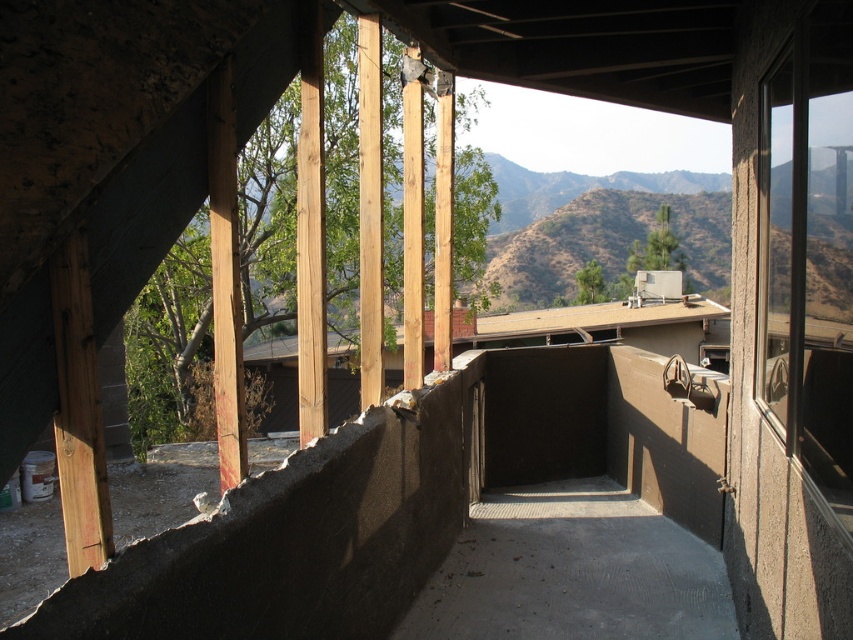
Between point (364, 138) and point (402, 314), which one is positioned in front?

Positioned in front is point (364, 138).

Which is behind, point (361, 266) or point (405, 131)?

Positioned behind is point (405, 131).

Who is more distant from viewer, (376,100) or (416,257)?

The point (416,257) is more distant.

Where is `natural wood beam at center`? Image resolution: width=853 pixels, height=640 pixels. natural wood beam at center is located at coordinates (369, 211).

Is point (215, 196) positioned after point (369, 72)?

No, it is not.

Is light brown wood at upper left thinner than natural wood beam at center?

Yes.

This screenshot has height=640, width=853. Identify the location of light brown wood at upper left. (225, 276).

Based on the photo, which is below, brown wood beam at center or natural wood beam at center?

brown wood beam at center

This screenshot has width=853, height=640. What do you see at coordinates (310, 230) in the screenshot? I see `brown wood beam at center` at bounding box center [310, 230].

Identify the location of brown wood beam at center. (310, 230).